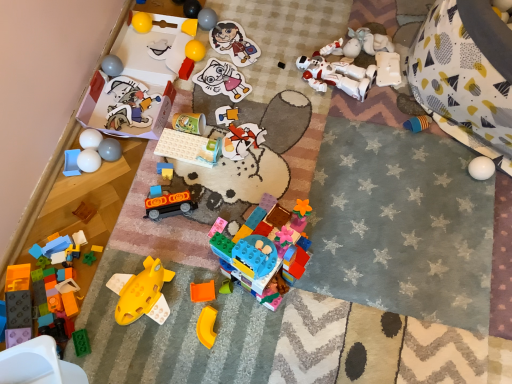
I want to click on free space between matte plastic sticker at upper center, marked as the fourth toy in a right-to-left arrangement, and black plastic train at center, the 14th toy from the right, so pyautogui.click(x=212, y=112).